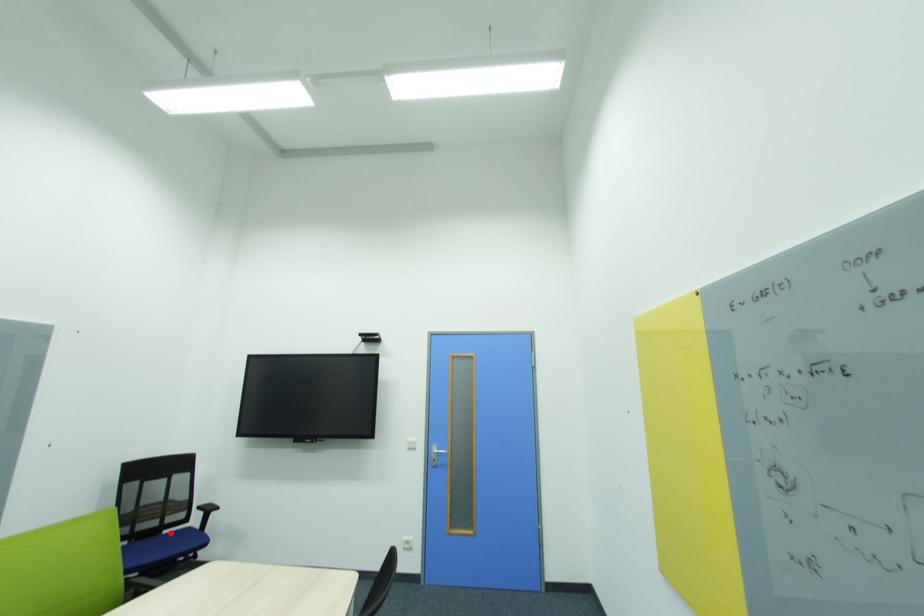
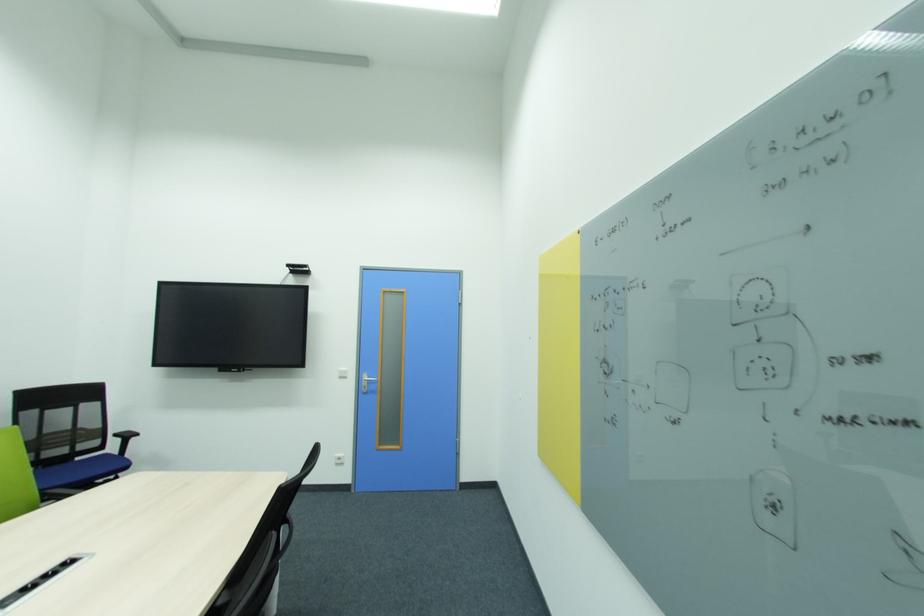
Question: I am providing you with two images of the same scene from different viewpoints. A red point is marked on the first image. At the location where the point appears in image 1, is it still visible in image 2?

Choices:
 (A) Yes
 (B) No

Answer: (A)